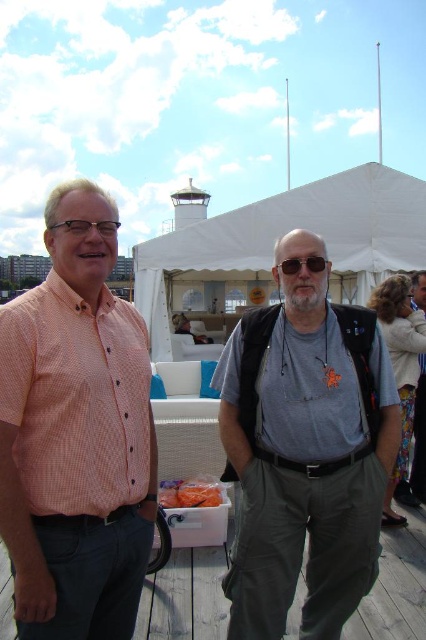
Question: Which of the following is the farthest from the observer?

Choices:
 (A) (380, 248)
 (B) (414, 384)
 (C) (417, 273)

Answer: (A)

Question: Does gray fabric backpack at center have a larger size compared to sunglasses at center?

Choices:
 (A) yes
 (B) no

Answer: (A)

Question: Which point is closer to the camera?

Choices:
 (A) (393, 288)
 (B) (340, 204)
 (C) (134, 420)
 (D) (419, 492)

Answer: (C)

Question: Where is gray matte t-shirt at center located in relation to orange plastic bag at center in the image?

Choices:
 (A) left
 (B) right

Answer: (B)

Question: Is orange checkered shirt at left further to the viewer compared to gray matte t-shirt at center?

Choices:
 (A) no
 (B) yes

Answer: (A)

Question: Which point appears closest to the camera in this image?

Choices:
 (A) (367, 472)
 (B) (313, 253)
 (C) (379, 298)

Answer: (A)